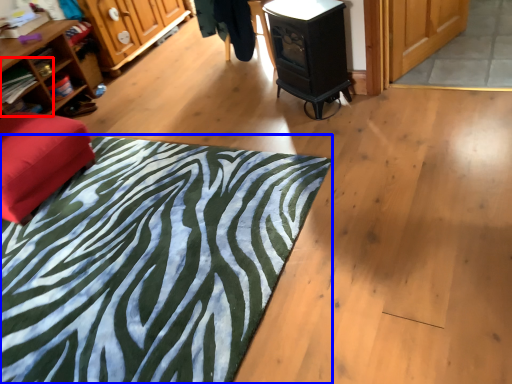
Question: Which point is closer to the camera, shelf (highlighted by a red box) or mat (highlighted by a blue box)?

Choices:
 (A) shelf
 (B) mat

Answer: (B)